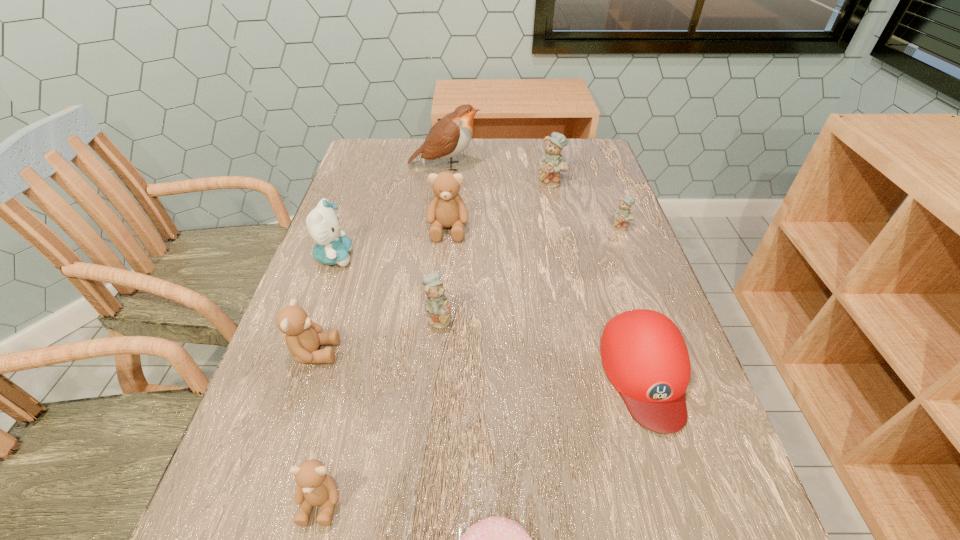
You are a GUI agent. You are given a task and a screenshot of the screen. Output one action in this format:
    pyautogui.click(x=<x>, y=<y>)
    Task: Click on the free space at the right edge of the desktop
    
    Given the screenshot: What is the action you would take?
    pyautogui.click(x=612, y=219)

Where is `free space between the leftmost blue teddy bear and the blue kitten`? free space between the leftmost blue teddy bear and the blue kitten is located at coordinates [x=387, y=287].

The image size is (960, 540). Find the location of `vacant area between the rightmost teddy bear and the second brown teddy bear from left to right`. vacant area between the rightmost teddy bear and the second brown teddy bear from left to right is located at coordinates (470, 364).

The height and width of the screenshot is (540, 960). I want to click on free spot between the leftmost teddy bear and the rightmost brown teddy bear, so click(381, 291).

Where is `vacant area that lies between the kitten and the baseball cap`? The width and height of the screenshot is (960, 540). vacant area that lies between the kitten and the baseball cap is located at coordinates (491, 315).

Where is `blank region between the farthest brown teddy bear and the kitten`? The width and height of the screenshot is (960, 540). blank region between the farthest brown teddy bear and the kitten is located at coordinates (392, 243).

This screenshot has width=960, height=540. I want to click on empty location between the biggest brown teddy bear and the smallest brown teddy bear, so click(384, 366).

Find the location of a particular element. free space between the blue kitten and the tallest object is located at coordinates (390, 212).

At what (x,y) coordinates should I click in order to perform the action: click on vacant area between the baseball cap and the smallest blue teddy bear. Please return your answer as a coordinate pair (x, y). Looking at the image, I should click on (634, 300).

At what (x,y) coordinates should I click in order to perform the action: click on object that stands as the ninth closest to the rightmost brown teddy bear. Please return your answer as a coordinate pair (x, y). This screenshot has height=540, width=960. Looking at the image, I should click on (495, 539).